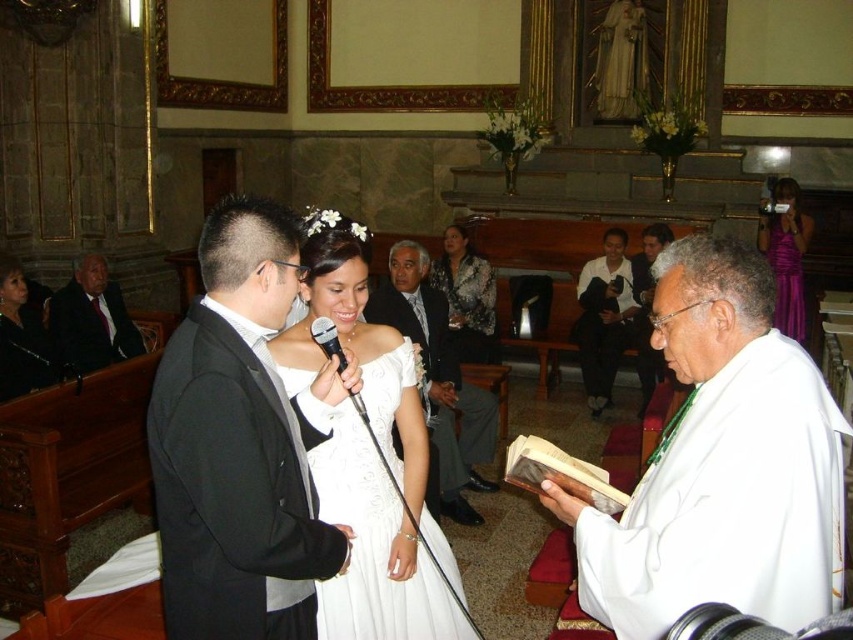
You are attending a wedding and see the bride wearing a white satin dress at center and the groom wearing a white satin suit at center. Which one is positioned lower in the image?

The white satin dress at center is below the white satin suit at center, so the bride in the white satin dress at center is positioned lower in the image.

You are a photographer standing at the entrance of the church. You want to take a photo of the white satin dress at center. Where should you aim your camera to capture it perfectly?

You should aim your camera at the point 0.816 on the x axis and 0.451 on the y axis to capture the white satin dress at center.

You are a photographer at the wedding ceremony. You need to adjust the camera focus so that both the black satin suit at center and the white satin suit at center are in focus. Which suit should you focus on first to ensure proper depth of field?

The black satin suit at center has a lesser height compared to white satin suit at center, so you should focus on the white satin suit at center first as it is taller and will require more depth of field to capture properly.